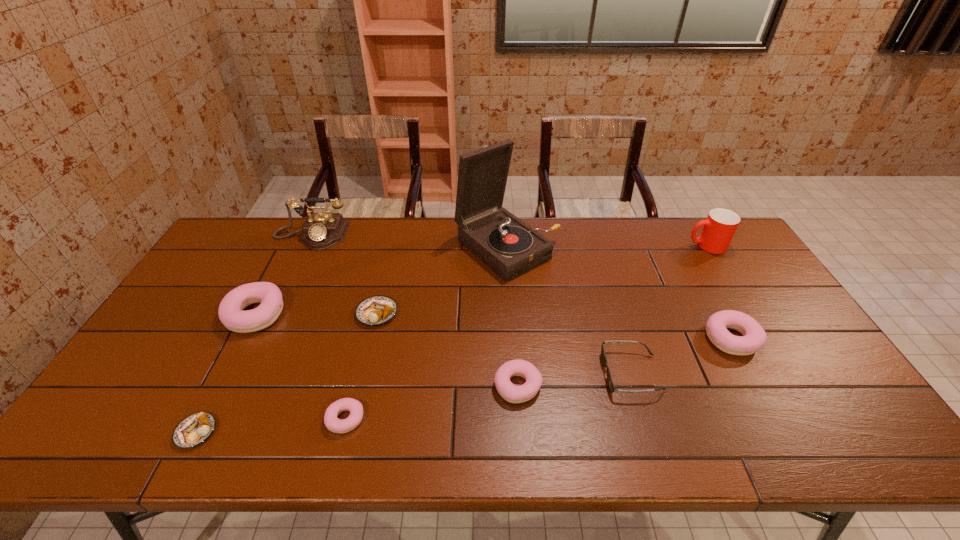
The image size is (960, 540). In the image, there is a desktop. Identify the location of vacant space at the near edge. (492, 440).

In the image, there is a desktop. Identify the location of vacant space at the right edge. Image resolution: width=960 pixels, height=540 pixels. (733, 276).

The width and height of the screenshot is (960, 540). In the image, there is a desktop. Identify the location of free space at the far left corner. (249, 254).

You are a GUI agent. You are given a task and a screenshot of the screen. Output one action in this format:
    pyautogui.click(x=<x>, y=<y>)
    Task: Click on the vacant position at the far right corner of the desktop
    This screenshot has height=540, width=960.
    Given the screenshot: What is the action you would take?
    pyautogui.click(x=735, y=248)

Locate an element on the screen. This screenshot has height=540, width=960. vacant space that's between the cup and the sixth shortest object is located at coordinates (719, 292).

Find the location of a particular element. This screenshot has height=540, width=960. free spot between the black sunglasses and the third biggest pink pastry is located at coordinates (575, 380).

The width and height of the screenshot is (960, 540). In order to click on free space between the telephone and the leftmost pink pastry in this screenshot , I will do `click(283, 275)`.

Identify the location of vacant area that lies between the telephone and the sunglasses. Image resolution: width=960 pixels, height=540 pixels. (471, 305).

This screenshot has width=960, height=540. I want to click on empty location between the biggest pink pastry and the eighth shortest object, so click(x=481, y=280).

At what (x,y) coordinates should I click in order to perform the action: click on free spot between the second tallest object and the third biggest pink pastry. Please return your answer as a coordinate pair (x, y). Looking at the image, I should click on (415, 311).